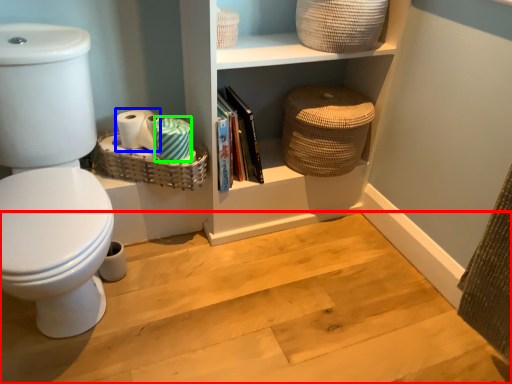
Question: Which object is positioned farthest from stair (highlighted by a red box)? Select from toilet paper (highlighted by a blue box) and toilet paper (highlighted by a green box).

Choices:
 (A) toilet paper
 (B) toilet paper

Answer: (A)